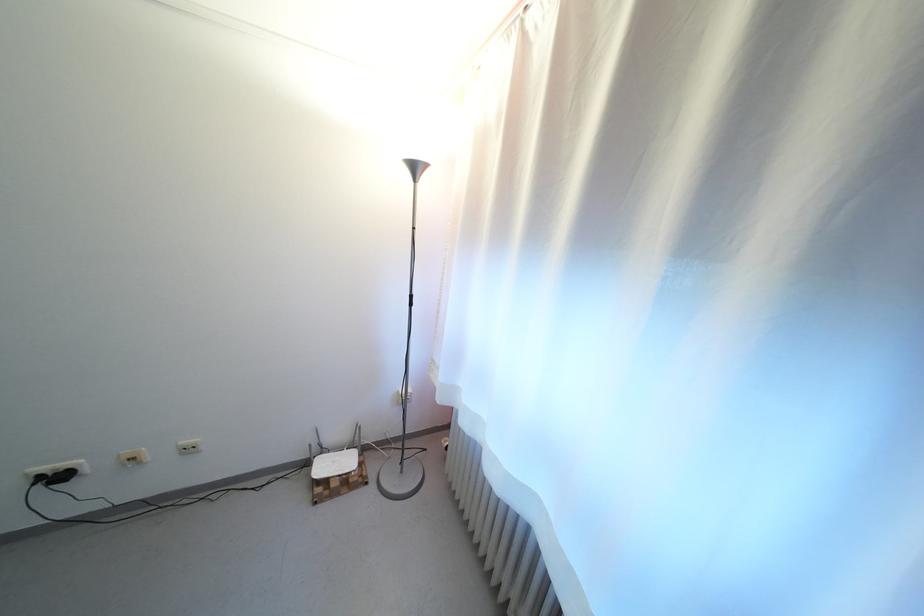
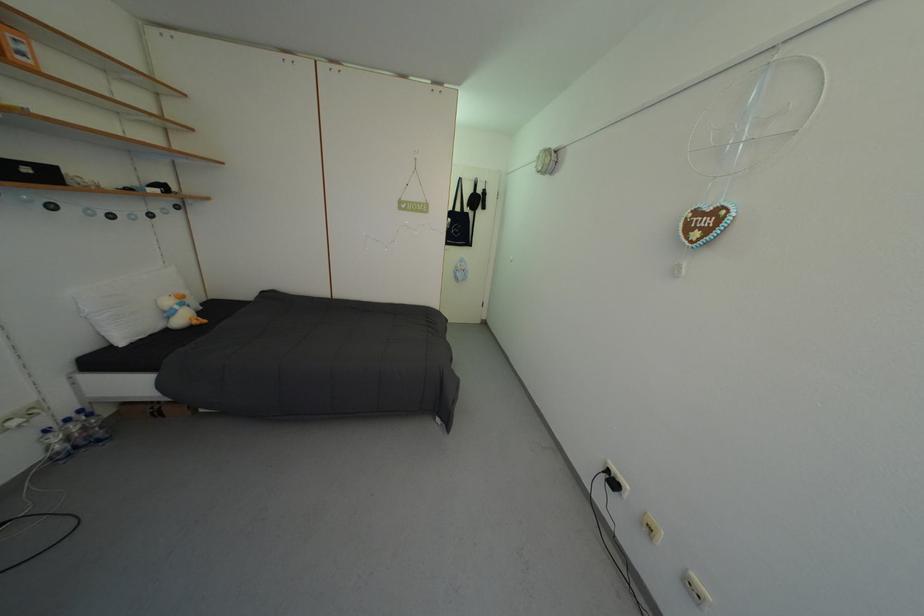
The images are taken continuously from a first-person perspective. In which direction is your viewpoint rotating?

The rotation direction of the camera is left-down.